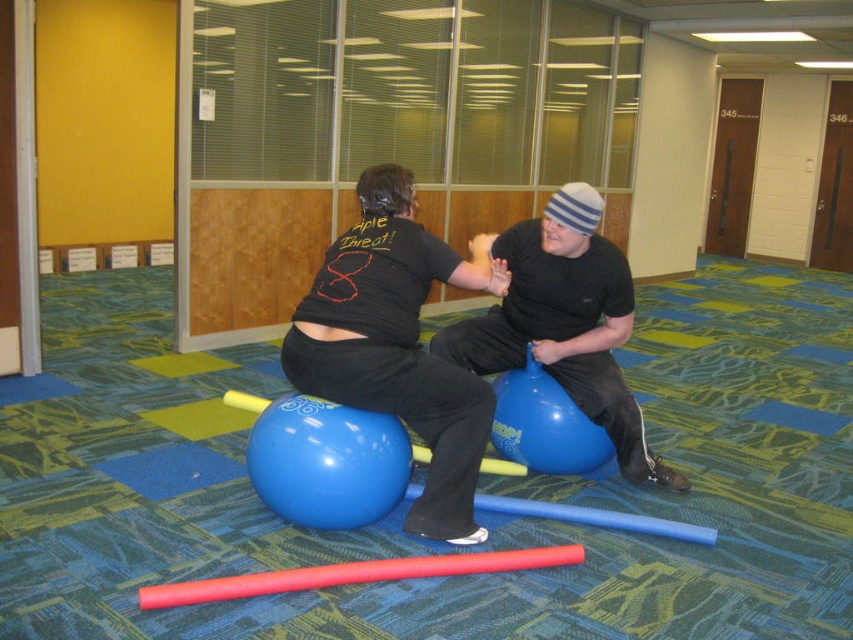
You are a physical therapist observing two patients seated on the shiny blue exercise ball at center and the blue rubber ball at center. You need to adjust their positions so that the ball they are sitting on is now to the right of the other. Which ball should you move and where?

The shiny blue exercise ball at center should be moved to the right of the blue rubber ball at center.

You are standing in the room and want to place a 10 feet long banner between the shiny blue exercise ball at center and the camera. Is the distance sufficient?

The distance between the shiny blue exercise ball at center and the camera is 8.03 feet, so the banner cannot be placed as it is longer than the available space.

You are a physical therapist designing an exercise routine for a patient who needs to balance on the shiny blue exercise ball at center and the blue rubber ball at center. Which ball should the patient start with to ensure stability?

The patient should start with the shiny blue exercise ball at center because it has a greater height, providing a more stable base for balancing compared to the shorter blue rubber ball at center.